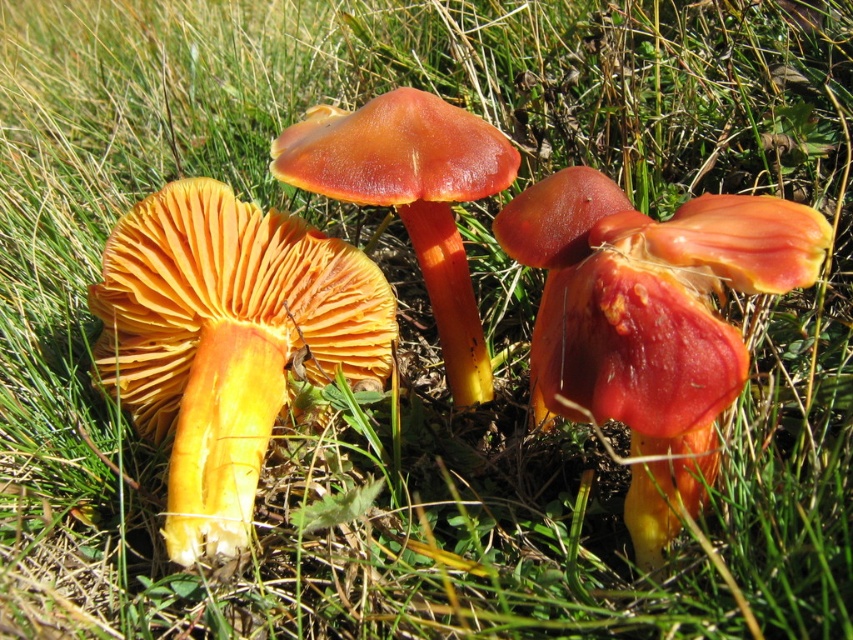
Between shiny orange mushroom at center and glossy orange mushroom at center, which one appears on the left side from the viewer's perspective?

Positioned to the left is glossy orange mushroom at center.

Find the location of `shiny orange mushroom at center`. shiny orange mushroom at center is located at coordinates (650, 321).

Which is more to the left, orange matte mushroom at left or glossy orange mushroom at center?

orange matte mushroom at left is more to the left.

From the picture: Does orange matte mushroom at left have a smaller size compared to glossy orange mushroom at center?

No.

I want to click on orange matte mushroom at left, so click(225, 340).

Identify the location of orange matte mushroom at left. point(225,340).

Is orange matte mushroom at left to the right of shiny orange mushroom at center from the viewer's perspective?

No, orange matte mushroom at left is not to the right of shiny orange mushroom at center.

Can you confirm if orange matte mushroom at left is smaller than shiny orange mushroom at center?

No.

What are the coordinates of `orange matte mushroom at left` in the screenshot? It's located at (225, 340).